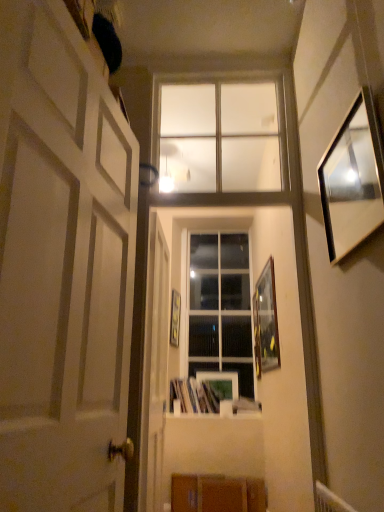
Question: From a real-world perspective, does wooden picture frame at center, marked as the second picture frame in a back-to-front arrangement, sit lower than clear glass window at upper center, arranged as the 2th window when ordered from the bottom?

Choices:
 (A) no
 (B) yes

Answer: (B)

Question: Is wooden picture frame at center, which ranks as the third picture frame in front-to-back order, to the right of clear glass window at upper center, arranged as the 2th window when ordered from the bottom, from the viewer's perspective?

Choices:
 (A) no
 (B) yes

Answer: (A)

Question: Is wooden picture frame at center, which ranks as the third picture frame in front-to-back order, in front of clear glass window at upper center, the second window viewed from the back?

Choices:
 (A) yes
 (B) no

Answer: (B)

Question: Is clear glass window at upper center, which ranks as the 1th window in front-to-back order, located within wooden picture frame at center, which ranks as the third picture frame in front-to-back order?

Choices:
 (A) yes
 (B) no

Answer: (B)

Question: Is wooden picture frame at center, marked as the second picture frame in a back-to-front arrangement, located outside clear glass window at upper center, placed as the 1th window when sorted from top to bottom?

Choices:
 (A) no
 (B) yes

Answer: (B)

Question: Considering the positions of wooden picture frame at right, the fourth picture frame in the left-to-right sequence, and white glossy door at center, which appears as the 2th door when viewed from the front, in the image, is wooden picture frame at right, the fourth picture frame in the left-to-right sequence, wider or thinner than white glossy door at center, which appears as the 2th door when viewed from the front,?

Choices:
 (A) wide
 (B) thin

Answer: (B)

Question: From a real-world perspective, is wooden picture frame at right, the fourth picture frame in the left-to-right sequence, physically located above or below white glossy door at center, which appears as the 2th door when viewed from the front?

Choices:
 (A) below
 (B) above

Answer: (B)

Question: From the image's perspective, is wooden picture frame at right, the 1th picture frame in the right-to-left sequence, positioned above or below white glossy door at center, which is the first door from back to front?

Choices:
 (A) below
 (B) above

Answer: (B)

Question: Looking at the image, does wooden picture frame at right, the fourth picture frame in the left-to-right sequence, seem bigger or smaller compared to white glossy door at center, which is the first door from back to front?

Choices:
 (A) small
 (B) big

Answer: (A)

Question: From a real-world perspective, is wooden picture frame at center, the 1th picture frame viewed from the left, above or below white matte door at left, the second door in the back-to-front sequence?

Choices:
 (A) below
 (B) above

Answer: (B)

Question: Considering the positions of wooden picture frame at center, marked as the second picture frame in a back-to-front arrangement, and white matte door at left, which appears as the first door when viewed from the front, in the image, is wooden picture frame at center, marked as the second picture frame in a back-to-front arrangement, bigger or smaller than white matte door at left, which appears as the first door when viewed from the front,?

Choices:
 (A) big
 (B) small

Answer: (B)

Question: Considering the relative positions of wooden picture frame at center, which appears as the fourth picture frame when viewed from the right, and white matte door at left, which appears as the first door when viewed from the front, in the image provided, is wooden picture frame at center, which appears as the fourth picture frame when viewed from the right, to the left or to the right of white matte door at left, which appears as the first door when viewed from the front,?

Choices:
 (A) left
 (B) right

Answer: (B)

Question: In terms of height, does wooden picture frame at center, the 1th picture frame viewed from the left, look taller or shorter compared to white matte door at left, the second door in the back-to-front sequence?

Choices:
 (A) tall
 (B) short

Answer: (B)

Question: Is matte wooden picture frame at center, placed as the 3th picture frame when sorted from right to left, taller or shorter than white matte door at left, the second door in the back-to-front sequence?

Choices:
 (A) short
 (B) tall

Answer: (A)

Question: Is matte wooden picture frame at center, the first picture frame viewed from the back, spatially inside white matte door at left, which appears as the first door when viewed from the front, or outside of it?

Choices:
 (A) inside
 (B) outside

Answer: (B)